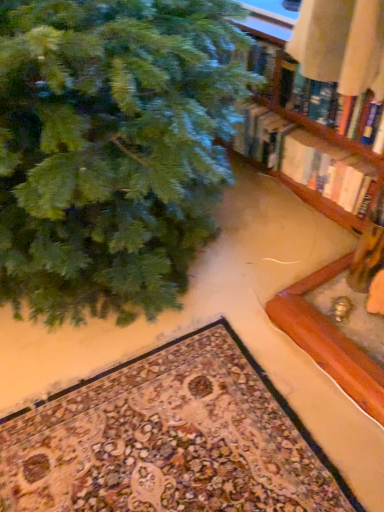
Identify the location of vacant area on top of hardcover book at upper right (from a real-world perspective). (x=342, y=156).